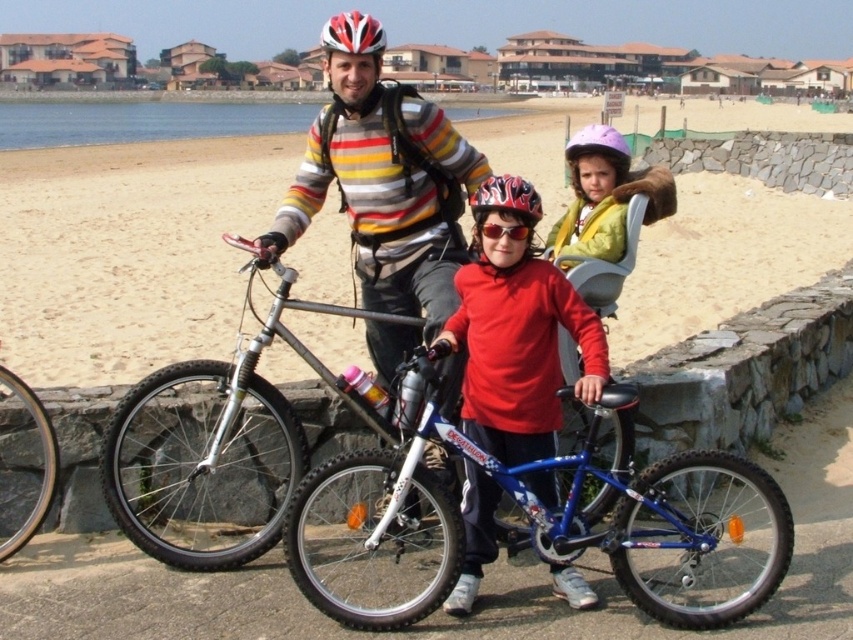
Question: Can you confirm if shiny red shirt at center is wider than red matte bicycle helmet at upper center?

Choices:
 (A) yes
 (B) no

Answer: (B)

Question: In this image, where is shiny red shirt at center located relative to purple matte helmet at center?

Choices:
 (A) right
 (B) left

Answer: (B)

Question: Which point is closer to the camera?

Choices:
 (A) striped cotton shirt at center
 (B) shiny red shirt at center
 (C) shiny multicolored helmet at center

Answer: (B)

Question: Can you confirm if shiny black bicycle at center is wider than shiny multicolored helmet at center?

Choices:
 (A) yes
 (B) no

Answer: (B)

Question: Among these points, which one is farthest from the camera?

Choices:
 (A) (39, 442)
 (B) (535, 262)
 (C) (381, 40)
 (D) (285, 218)

Answer: (D)

Question: Which of the following is the farthest from the observer?

Choices:
 (A) striped cotton shirt at center
 (B) shiny red shirt at center
 (C) blue metallic bicycle at center
 (D) silver metallic bicycle at center

Answer: (A)